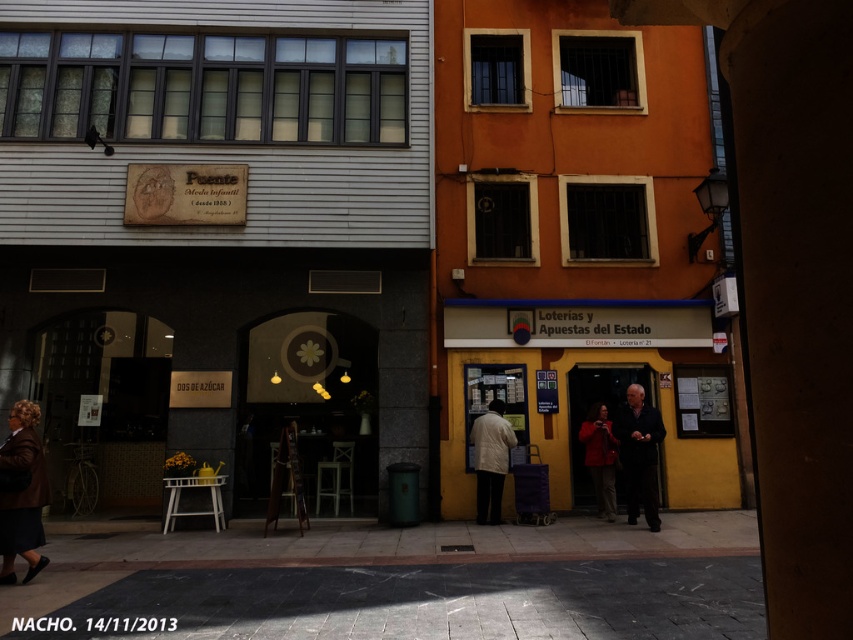
Between point (706, 310) and point (607, 481), which one is positioned behind?

The point (706, 310) is more distant.

Is yellow matte building at center to the right of matte red coat at center from the viewer's perspective?

In fact, yellow matte building at center is to the left of matte red coat at center.

Where is `yellow matte building at center`? yellow matte building at center is located at coordinates (583, 388).

Identify the location of yellow matte building at center. (583, 388).

Who is shorter, dark brown leather coat at lower left or white matte jacket at center?

dark brown leather coat at lower left is shorter.

Is point (6, 452) positioned in front of point (474, 420)?

Yes.

Between point (45, 561) and point (471, 442), which one is positioned behind?

Positioned behind is point (471, 442).

Identify the location of dark brown leather coat at lower left. (21, 493).

Between point (474, 344) and point (36, 474), which one is positioned behind?

The point (474, 344) is behind.

Which is behind, point (587, 310) or point (0, 508)?

Positioned behind is point (587, 310).

The height and width of the screenshot is (640, 853). I want to click on yellow matte building at center, so click(583, 388).